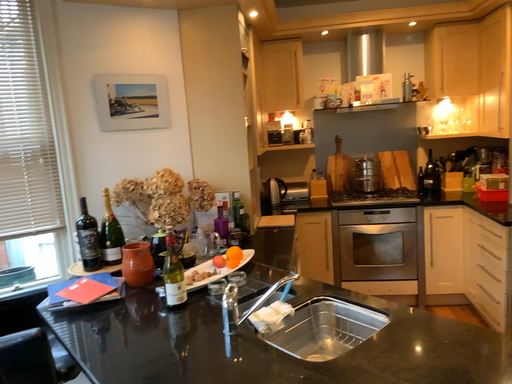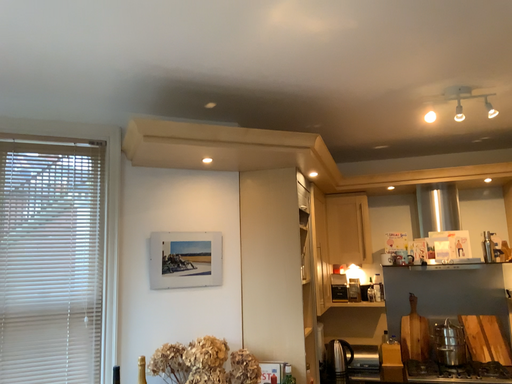
Question: Which way did the camera rotate in the video?

Choices:
 (A) rotated right
 (B) rotated left

Answer: (B)